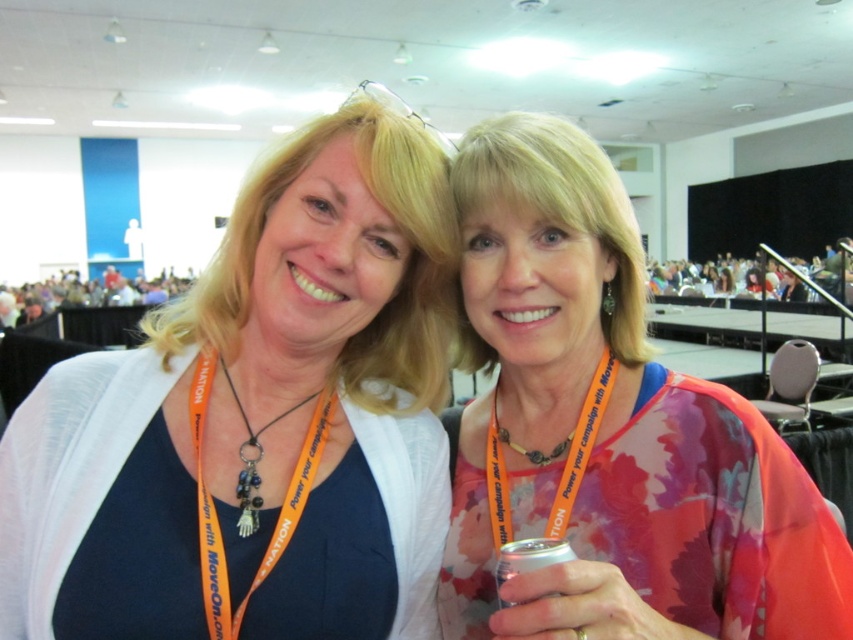
Who is more distant from viewer, (730,396) or (251,448)?

Point (251,448)

Who is more forward, (660, 422) or (312, 452)?

Point (312, 452) is in front.

Locate an element on the screen. The image size is (853, 640). floral silk blouse at center is located at coordinates (608, 429).

Who is higher up, orange fabric lanyard at center or silver metallic can at lower center?

orange fabric lanyard at center is higher up.

Who is more distant from viewer, (x=238, y=534) or (x=537, y=556)?

Positioned behind is point (x=238, y=534).

Locate an element on the screen. orange fabric lanyard at center is located at coordinates (251, 461).

Locate an element on the screen. Image resolution: width=853 pixels, height=640 pixels. orange fabric lanyard at center is located at coordinates (251, 461).

Where is `white fabric shirt at center`? The height and width of the screenshot is (640, 853). white fabric shirt at center is located at coordinates (257, 420).

Which is below, white fabric shirt at center or orange fabric lanyard at center?

orange fabric lanyard at center is lower down.

Identify the location of white fabric shirt at center. Image resolution: width=853 pixels, height=640 pixels. (257, 420).